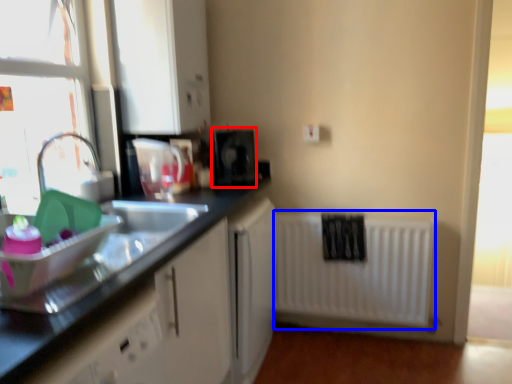
Question: Which object is closer to the camera taking this photo, appliance (highlighted by a red box) or radiator (highlighted by a blue box)?

Choices:
 (A) appliance
 (B) radiator

Answer: (A)